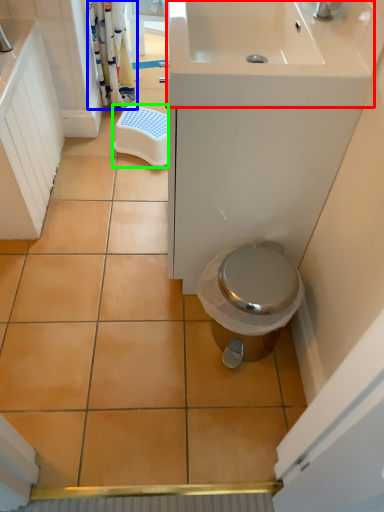
Question: Considering the real-world distances, which object is farthest from sink (highlighted by a red box)? shower curtain (highlighted by a blue box) or step stool (highlighted by a green box)?

Choices:
 (A) shower curtain
 (B) step stool

Answer: (A)